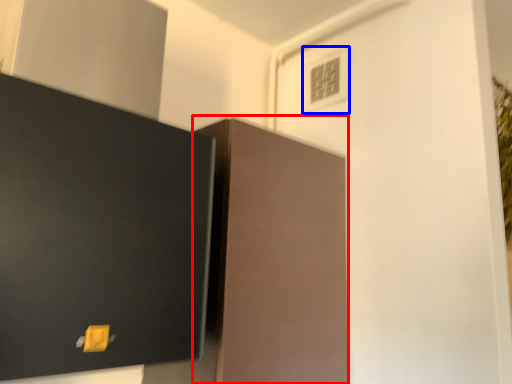
Question: Which object is further to the camera taking this photo, cabinetry (highlighted by a red box) or light switch (highlighted by a blue box)?

Choices:
 (A) cabinetry
 (B) light switch

Answer: (B)